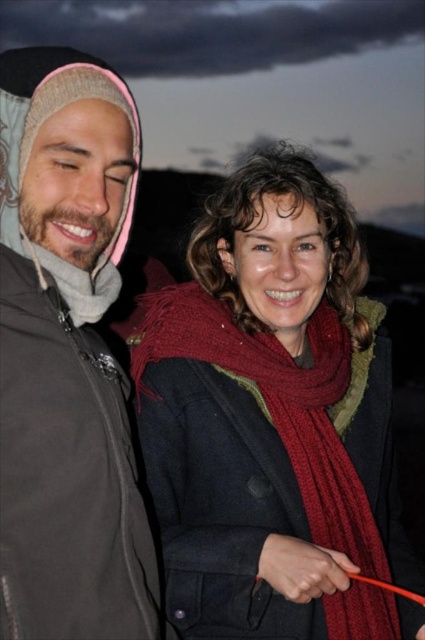
Does matte gray jacket at left appear over red knitted scarf at center?

Yes, matte gray jacket at left is above red knitted scarf at center.

This screenshot has width=425, height=640. Identify the location of matte gray jacket at left. (68, 356).